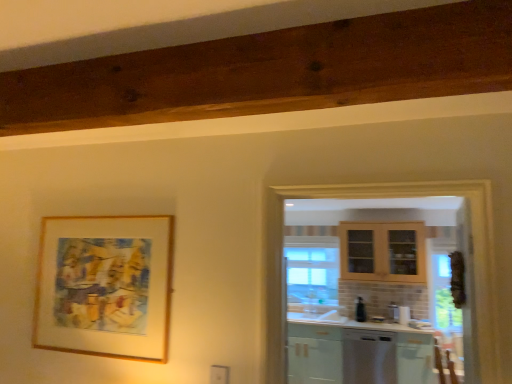
Question: From a real-world perspective, relative to black glossy soap dispenser at center, is wooden frame at upper left vertically above or below?

Choices:
 (A) above
 (B) below

Answer: (A)

Question: Relative to black glossy soap dispenser at center, is wooden frame at upper left in front or behind?

Choices:
 (A) behind
 (B) front

Answer: (B)

Question: Which object is the farthest from the black glossy soap dispenser at center?

Choices:
 (A) wooden frame at upper left
 (B) satin white dishwasher at lower right
 (C) matte white cabinet at lower right

Answer: (A)

Question: Which is farther from the satin white dishwasher at lower right?

Choices:
 (A) matte white cabinet at lower right
 (B) wooden frame at upper left
 (C) black glossy soap dispenser at center

Answer: (B)